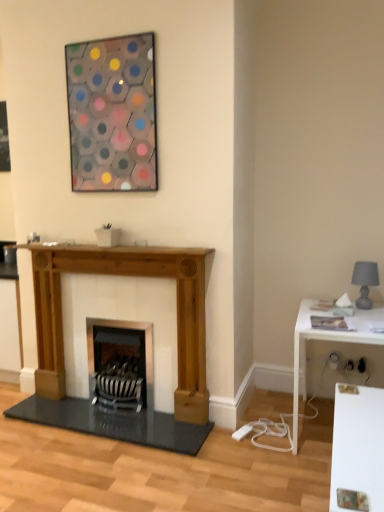
At what (x,y) coordinates should I click in order to perform the action: click on gray fabric lampshade at right. Please return your answer as a coordinate pair (x, y). This screenshot has width=384, height=512. Looking at the image, I should click on (365, 282).

Locate an element on the screen. The width and height of the screenshot is (384, 512). black metal wood burning stove at center is located at coordinates (x=121, y=361).

Consider the image. Measure the distance between black metal wood burning stove at center and camera.

black metal wood burning stove at center is 2.80 meters from camera.

Locate an element on the screen. The height and width of the screenshot is (512, 384). metallic hexagonal artwork at upper center is located at coordinates (113, 114).

Locate an element on the screen. The image size is (384, 512). natural wood fireplace at center is located at coordinates (126, 275).

You are a GUI agent. You are given a task and a screenshot of the screen. Output one action in this format:
    pyautogui.click(x=<x>, y=<y>)
    Task: Click on the white glossy table at right
    This screenshot has height=512, width=384.
    Given the screenshot: What is the action you would take?
    pyautogui.click(x=327, y=340)

What is the approximate width of white glossy table at right?

77.42 centimeters.

This screenshot has height=512, width=384. What are the coordinates of `gray fabric lampshade at right` in the screenshot? It's located at (365, 282).

Between black metal wood burning stove at center and white glossy table at right, which one is positioned in front?

white glossy table at right is in front.

Is black metal wood burning stove at center inside or outside of white glossy table at right?

black metal wood burning stove at center is not enclosed by white glossy table at right.

From the image's perspective, between black metal wood burning stove at center and white glossy table at right, which one is located above?

white glossy table at right.

Is point (133, 393) closer to camera compared to point (367, 318)?

No, (133, 393) is behind (367, 318).

Is white glossy table at right shorter than gray fabric lampshade at right?

Answer: Incorrect, the height of white glossy table at right does not fall short of that of gray fabric lampshade at right.

Based on the photo, considering the relative positions of white glossy table at right and gray fabric lampshade at right in the image provided, is white glossy table at right to the left or to the right of gray fabric lampshade at right?

Clearly, white glossy table at right is on the left of gray fabric lampshade at right in the image.

In the image, there is a gray fabric lampshade at right. At what (x,y) coordinates should I click in order to perform the action: click on table below it (from the image's perspective). Please return your answer as a coordinate pair (x, y). The height and width of the screenshot is (512, 384). Looking at the image, I should click on (x=327, y=340).

From the picture: From the image's perspective, is metallic hexagonal artwork at upper center on gray fabric lampshade at right?

Correct, metallic hexagonal artwork at upper center appears higher than gray fabric lampshade at right in the image.

Is metallic hexagonal artwork at upper center oriented away from gray fabric lampshade at right?

No, metallic hexagonal artwork at upper center is not facing away from gray fabric lampshade at right.

From a real-world perspective, who is located higher, metallic hexagonal artwork at upper center or gray fabric lampshade at right?

In real-world perspective, metallic hexagonal artwork at upper center is above.

Which is farther, (135, 103) or (356, 273)?

Positioned behind is point (356, 273).

From the image's perspective, is metallic hexagonal artwork at upper center above natural wood fireplace at center?

Yes, from the image's perspective, metallic hexagonal artwork at upper center is over natural wood fireplace at center.

How many degrees apart are the facing directions of metallic hexagonal artwork at upper center and natural wood fireplace at center?

0.052 degrees.

Which of these two, metallic hexagonal artwork at upper center or natural wood fireplace at center, is wider?

natural wood fireplace at center.

Which object is closer to the camera taking this photo, metallic hexagonal artwork at upper center or natural wood fireplace at center?

metallic hexagonal artwork at upper center is closer to the camera.

Can you confirm if gray fabric lampshade at right is positioned to the right of white glossy table at right?

Yes.

Between gray fabric lampshade at right and white glossy table at right, which one has smaller size?

gray fabric lampshade at right is smaller.

Considering the points (376, 282) and (308, 323), which point is in front, point (376, 282) or point (308, 323)?

Positioned in front is point (308, 323).

Between gray fabric lampshade at right and white glossy table at right, which one has more height?

white glossy table at right is taller.

Would you say white glossy table at right is inside or outside natural wood fireplace at center?

white glossy table at right cannot be found inside natural wood fireplace at center.

Is white glossy table at right oriented towards natural wood fireplace at center?

No.

Does white glossy table at right come behind natural wood fireplace at center?

No, white glossy table at right is closer to the camera.

From a real-world perspective, is white glossy table at right positioned over natural wood fireplace at center based on gravity?

Incorrect, from a real-world perspective, white glossy table at right is lower than natural wood fireplace at center.

Looking at this image, which object is more forward, natural wood fireplace at center or gray fabric lampshade at right?

Positioned in front is natural wood fireplace at center.

From a real-world perspective, relative to gray fabric lampshade at right, is natural wood fireplace at center vertically above or below?

natural wood fireplace at center is situated lower than gray fabric lampshade at right in the real world.

From the image's perspective, is natural wood fireplace at center over gray fabric lampshade at right?

No, from the image's perspective, natural wood fireplace at center is not above gray fabric lampshade at right.

Consider the image. How different are the orientations of natural wood fireplace at center and gray fabric lampshade at right in degrees?

The facing directions of natural wood fireplace at center and gray fabric lampshade at right are 0.000659 degrees apart.

The width and height of the screenshot is (384, 512). I want to click on table above the black metal wood burning stove at center (from a real-world perspective), so click(x=327, y=340).

At what (x,y) coordinates should I click in order to perform the action: click on table that is on the left side of gray fabric lampshade at right. Please return your answer as a coordinate pair (x, y). The height and width of the screenshot is (512, 384). Looking at the image, I should click on (327, 340).

When comparing their distances from white glossy table at right, does gray fabric lampshade at right or black metal wood burning stove at center seem closer?

Among the two, gray fabric lampshade at right is located nearer to white glossy table at right.

Considering their positions, is metallic hexagonal artwork at upper center positioned further to natural wood fireplace at center than white glossy table at right?

white glossy table at right is further to natural wood fireplace at center.

From the image, which object appears to be nearer to metallic hexagonal artwork at upper center, white glossy table at right or black metal wood burning stove at center?

black metal wood burning stove at center is closer to metallic hexagonal artwork at upper center.

From the image, which object appears to be nearer to gray fabric lampshade at right, natural wood fireplace at center or white glossy table at right?

The object closer to gray fabric lampshade at right is white glossy table at right.

Looking at the image, which one is located closer to white glossy table at right, natural wood fireplace at center or metallic hexagonal artwork at upper center?

Among the two, natural wood fireplace at center is located nearer to white glossy table at right.

Based on their spatial positions, is white glossy table at right or metallic hexagonal artwork at upper center closer to gray fabric lampshade at right?

white glossy table at right.

Which object lies further to the anchor point natural wood fireplace at center, white glossy table at right or black metal wood burning stove at center?

white glossy table at right lies further to natural wood fireplace at center than the other object.

Considering their positions, is metallic hexagonal artwork at upper center positioned further to black metal wood burning stove at center than white glossy table at right?

metallic hexagonal artwork at upper center is further to black metal wood burning stove at center.

You are a GUI agent. You are given a task and a screenshot of the screen. Output one action in this format:
    pyautogui.click(x=<x>, y=<y>)
    Task: Click on the table between metallic hexagonal artwork at upper center and black metal wood burning stove at center vertically
    The image size is (384, 512).
    Given the screenshot: What is the action you would take?
    pyautogui.click(x=327, y=340)

Image resolution: width=384 pixels, height=512 pixels. I want to click on fireplace that lies between metallic hexagonal artwork at upper center and white glossy table at right from top to bottom, so click(x=126, y=275).

At what (x,y) coordinates should I click in order to perform the action: click on wood burning stove between metallic hexagonal artwork at upper center and gray fabric lampshade at right. Please return your answer as a coordinate pair (x, y). This screenshot has height=512, width=384. Looking at the image, I should click on click(x=121, y=361).

This screenshot has height=512, width=384. In order to click on fireplace that lies between metallic hexagonal artwork at upper center and black metal wood burning stove at center from top to bottom in this screenshot , I will do `click(126, 275)`.